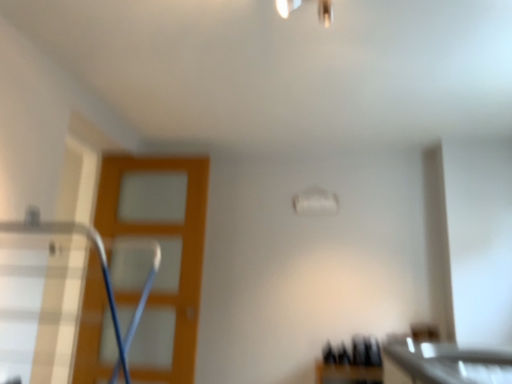
Question: Is metallic silver swivel chair at left shorter than white glossy countertop at lower right?

Choices:
 (A) no
 (B) yes

Answer: (A)

Question: Is metallic silver swivel chair at left thinner than white glossy countertop at lower right?

Choices:
 (A) yes
 (B) no

Answer: (B)

Question: Is metallic silver swivel chair at left looking in the opposite direction of white glossy countertop at lower right?

Choices:
 (A) no
 (B) yes

Answer: (A)

Question: Considering the relative sizes of metallic silver swivel chair at left and white glossy countertop at lower right in the image provided, is metallic silver swivel chair at left bigger than white glossy countertop at lower right?

Choices:
 (A) yes
 (B) no

Answer: (A)

Question: Would you say white glossy countertop at lower right is part of metallic silver swivel chair at left's contents?

Choices:
 (A) yes
 (B) no

Answer: (B)

Question: Is metallic silver swivel chair at left at the left side of white glossy countertop at lower right?

Choices:
 (A) no
 (B) yes

Answer: (B)

Question: Considering the relative sizes of white glossy countertop at lower right and metallic silver swivel chair at left in the image provided, is white glossy countertop at lower right taller than metallic silver swivel chair at left?

Choices:
 (A) no
 (B) yes

Answer: (A)

Question: Would you say white glossy countertop at lower right is outside metallic silver swivel chair at left?

Choices:
 (A) yes
 (B) no

Answer: (A)

Question: Considering the relative positions of white glossy countertop at lower right and metallic silver swivel chair at left in the image provided, is white glossy countertop at lower right to the left of metallic silver swivel chair at left from the viewer's perspective?

Choices:
 (A) yes
 (B) no

Answer: (B)

Question: Is white glossy countertop at lower right positioned behind metallic silver swivel chair at left?

Choices:
 (A) yes
 (B) no

Answer: (A)

Question: Is white glossy countertop at lower right bigger than metallic silver swivel chair at left?

Choices:
 (A) no
 (B) yes

Answer: (A)

Question: From the image's perspective, is white glossy countertop at lower right on top of metallic silver swivel chair at left?

Choices:
 (A) yes
 (B) no

Answer: (B)

Question: From the image's perspective, is orange wood screen door at left on top of metallic silver swivel chair at left?

Choices:
 (A) yes
 (B) no

Answer: (B)